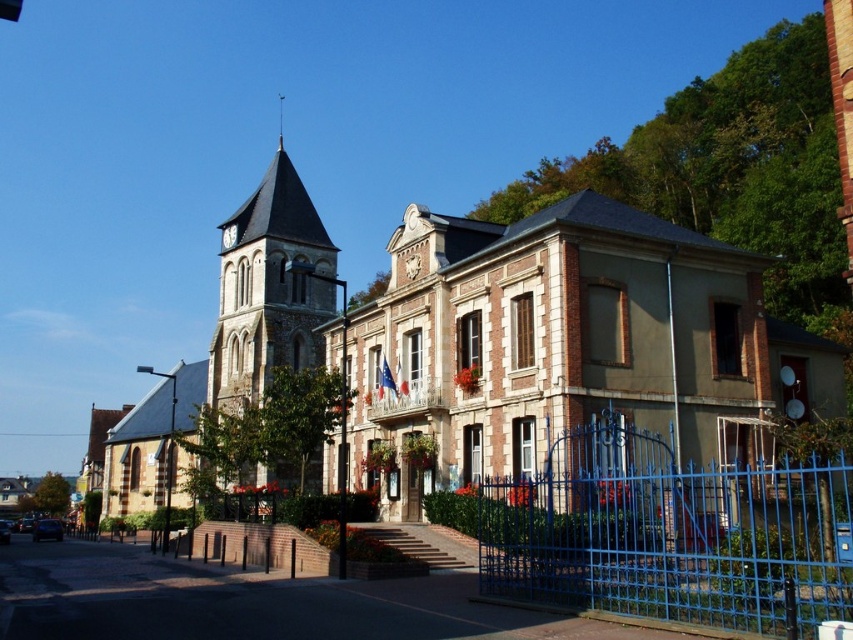
Is point (566, 532) positioned after point (383, 364)?

No.

Is point (845, 476) more distant than point (383, 385)?

No.

Where is `blue metal gate at center`? blue metal gate at center is located at coordinates (672, 532).

Is brick church at center behind french flag at center?

No, it is not.

Is brick church at center thinner than french flag at center?

No.

I want to click on brick church at center, so click(567, 342).

Does stone clock tower at center-left have a smaller size compared to white clock tower at upper center?

No.

Which is more to the left, stone clock tower at center-left or white clock tower at upper center?

From the viewer's perspective, stone clock tower at center-left appears more on the left side.

Is point (285, 268) closer to viewer compared to point (227, 236)?

That is True.

Find the location of `stone clock tower at center-left`. stone clock tower at center-left is located at coordinates (270, 288).